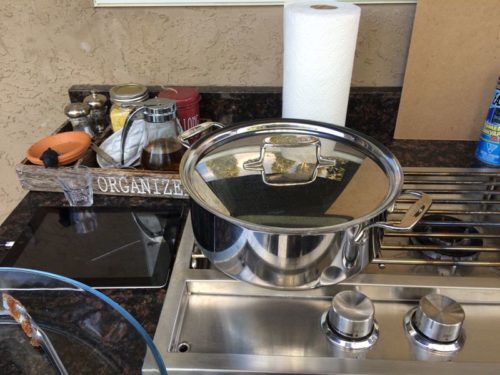
In order to click on paper towel roll in this screenshot , I will do `click(312, 62)`.